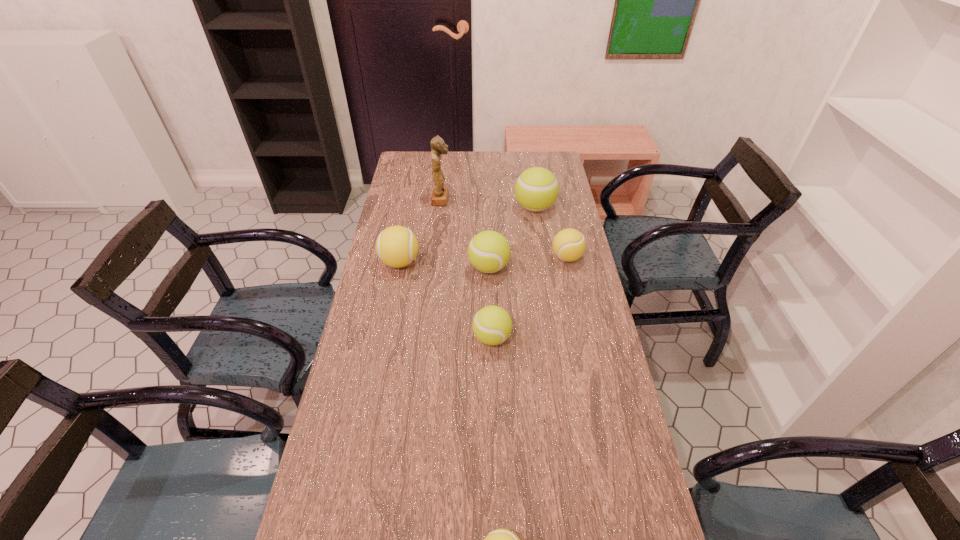
Image resolution: width=960 pixels, height=540 pixels. What are the coordinates of `vacant region between the rightmost yellow tennis ball and the nearest green tennis ball` in the screenshot? It's located at (530, 298).

You are a GUI agent. You are given a task and a screenshot of the screen. Output one action in this format:
    pyautogui.click(x=<x>, y=<y>)
    Task: Click on the unoccupied position between the figurine and the second farthest green tennis ball
    
    Given the screenshot: What is the action you would take?
    pyautogui.click(x=466, y=234)

Find the location of a particular element. This screenshot has height=540, width=960. free space between the figurine and the rightmost yellow tennis ball is located at coordinates (504, 228).

The width and height of the screenshot is (960, 540). I want to click on empty location between the tallest tennis ball and the nearest green tennis ball, so click(x=514, y=273).

Where is `vacant area that lies between the second biggest green tennis ball and the sixth shortest object`? The image size is (960, 540). vacant area that lies between the second biggest green tennis ball and the sixth shortest object is located at coordinates (512, 238).

Image resolution: width=960 pixels, height=540 pixels. Identify the location of empty space between the nearest green tennis ball and the figurine. (467, 269).

Find the location of a particular element. This screenshot has width=960, height=540. blank region between the second nearest tennis ball and the tallest tennis ball is located at coordinates (514, 273).

At what (x,y) coordinates should I click in order to perform the action: click on vacant space that is in between the tallest object and the biggest green tennis ball. Please return your answer as a coordinate pair (x, y). The height and width of the screenshot is (540, 960). Looking at the image, I should click on (489, 204).

Where is `the sixth closest object relative to the nearest green tennis ball`? The image size is (960, 540). the sixth closest object relative to the nearest green tennis ball is located at coordinates (440, 193).

At what (x,y) coordinates should I click in order to perform the action: click on object that is the fourth nearest to the second smallest yellow tennis ball. Please return your answer as a coordinate pair (x, y). Looking at the image, I should click on (440, 193).